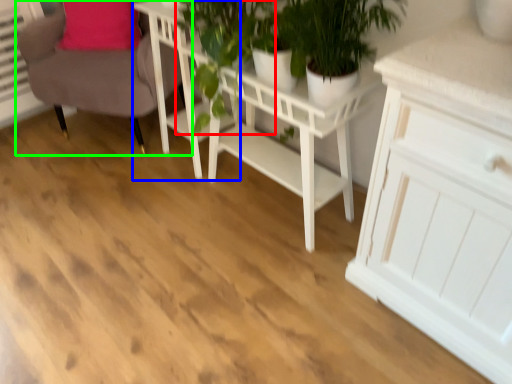
Question: Which object is the farthest from plant (highlighted by a red box)? Choose among these: table (highlighted by a blue box) or chair (highlighted by a green box).

Choices:
 (A) table
 (B) chair

Answer: (B)